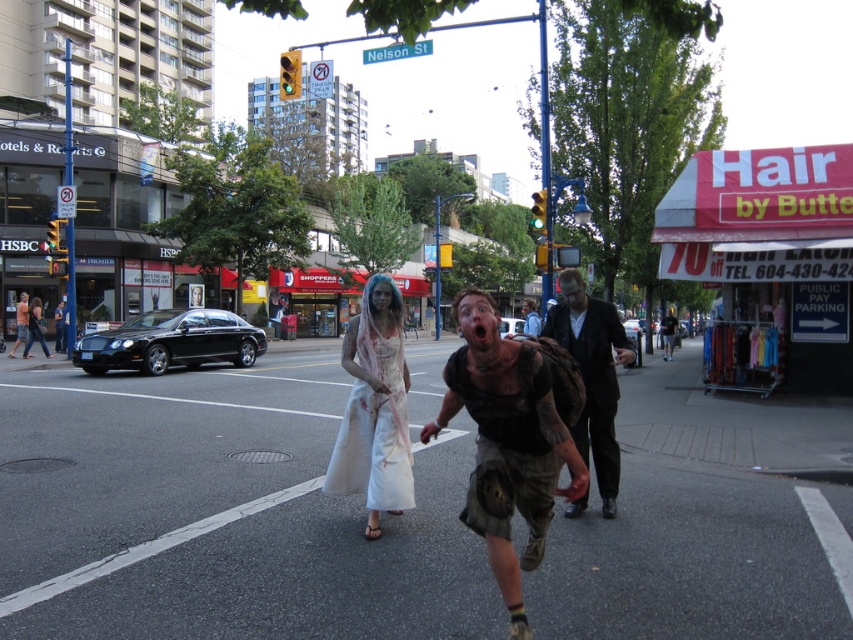
Find the location of a particular element. This screenshot has height=640, width=853. white cotton dress at center is located at coordinates (374, 410).

From the picture: Between white cotton dress at center and dark brown leather jacket at center, which one is positioned lower?

dark brown leather jacket at center is below.

I want to click on white cotton dress at center, so click(x=374, y=410).

This screenshot has width=853, height=640. Find the location of `white cotton dress at center`. white cotton dress at center is located at coordinates (374, 410).

Between point (532, 435) and point (601, 449), which one is positioned in front?

Point (532, 435) is in front.

Is black matte tank top at center wider than dark brown leather jacket at center?

Yes, black matte tank top at center is wider than dark brown leather jacket at center.

Locate an element on the screen. The image size is (853, 640). black matte tank top at center is located at coordinates (508, 442).

Who is positioned more to the right, black matte tank top at center or white cotton dress at center?

Positioned to the right is black matte tank top at center.

From the picture: Does black matte tank top at center appear on the left side of white cotton dress at center?

In fact, black matte tank top at center is to the right of white cotton dress at center.

I want to click on black matte tank top at center, so click(508, 442).